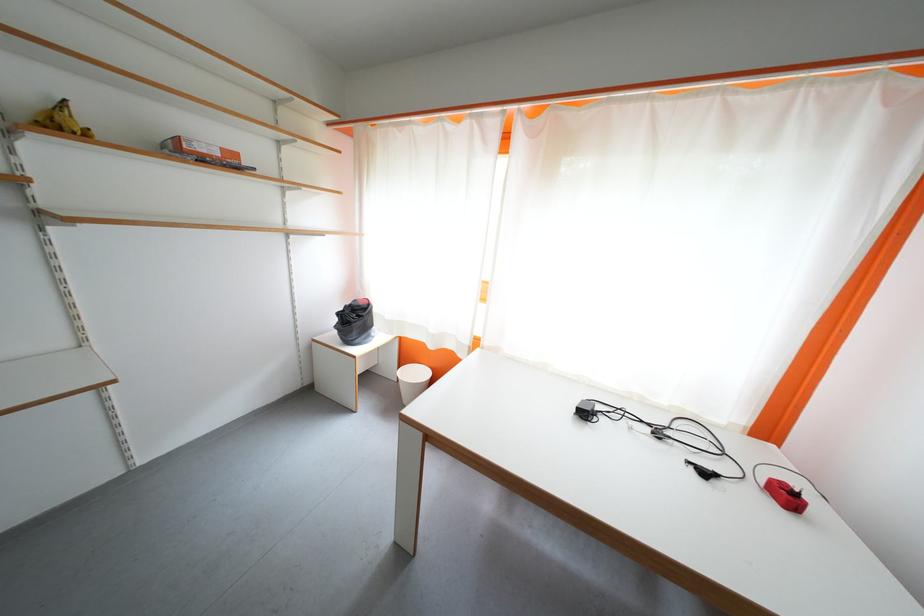
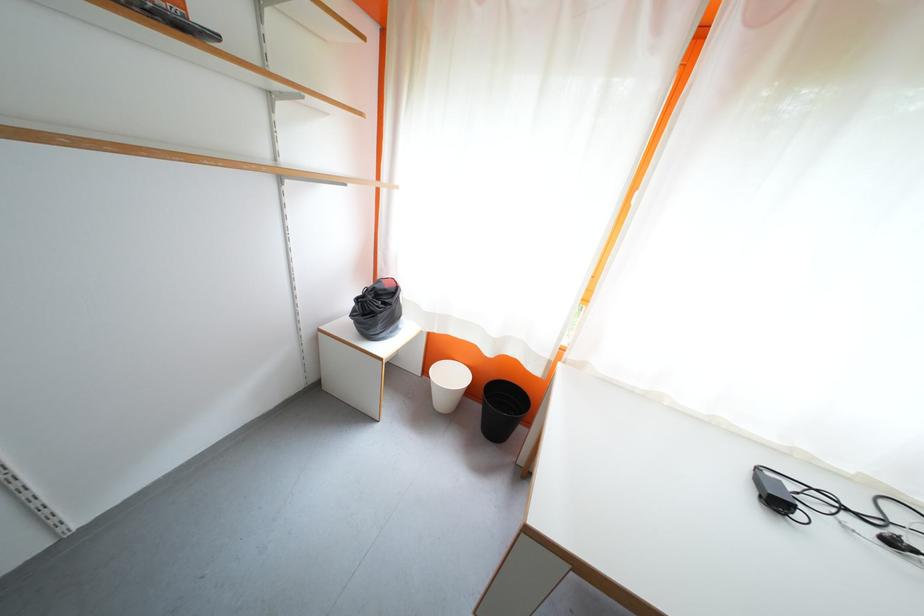
Question: How did the camera likely rotate?

Choices:
 (A) Left
 (B) Right
 (C) Up
 (D) Down

Answer: (D)